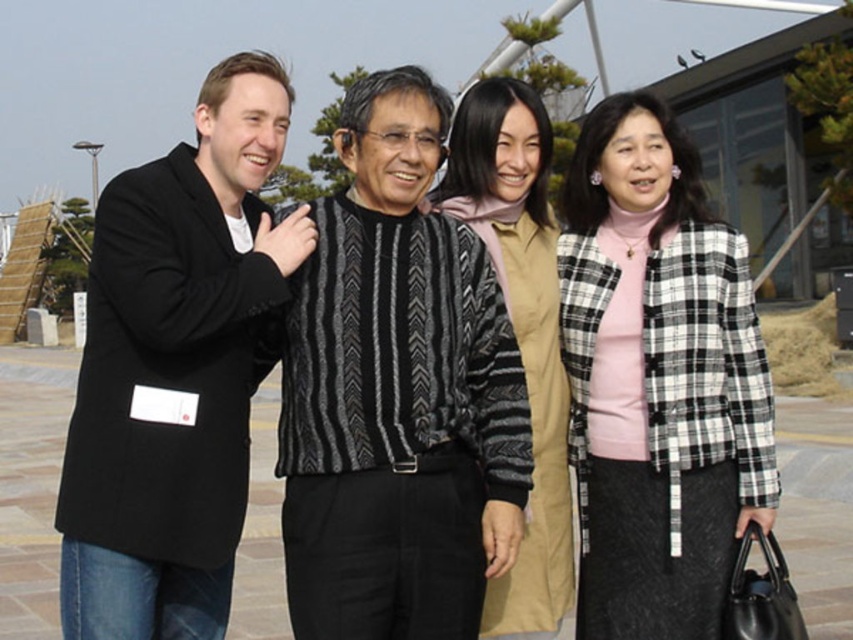
Question: Which of the following is the closest to the observer?

Choices:
 (A) black matte coat at left
 (B) black textured sweater at center

Answer: (A)

Question: Is black textured sweater at center to the left of black matte coat at left from the viewer's perspective?

Choices:
 (A) yes
 (B) no

Answer: (B)

Question: Which point appears farthest from the camera in this image?

Choices:
 (A) (543, 198)
 (B) (402, 348)
 (C) (744, 401)
 (D) (132, 557)

Answer: (A)

Question: Can you confirm if black textured sweater at center is positioned above checkered wool jacket at right?

Choices:
 (A) yes
 (B) no

Answer: (A)

Question: Which is nearer to the beige textured cardigan at center?

Choices:
 (A) black matte coat at left
 (B) black textured sweater at center
 (C) checkered wool jacket at right

Answer: (C)

Question: Can you confirm if black textured sweater at center is positioned to the left of checkered wool jacket at right?

Choices:
 (A) yes
 (B) no

Answer: (A)